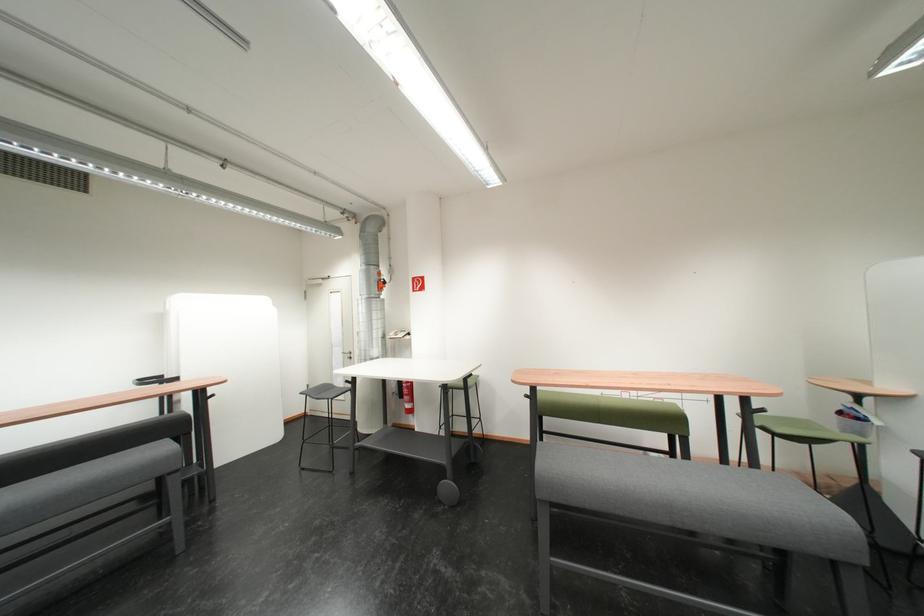
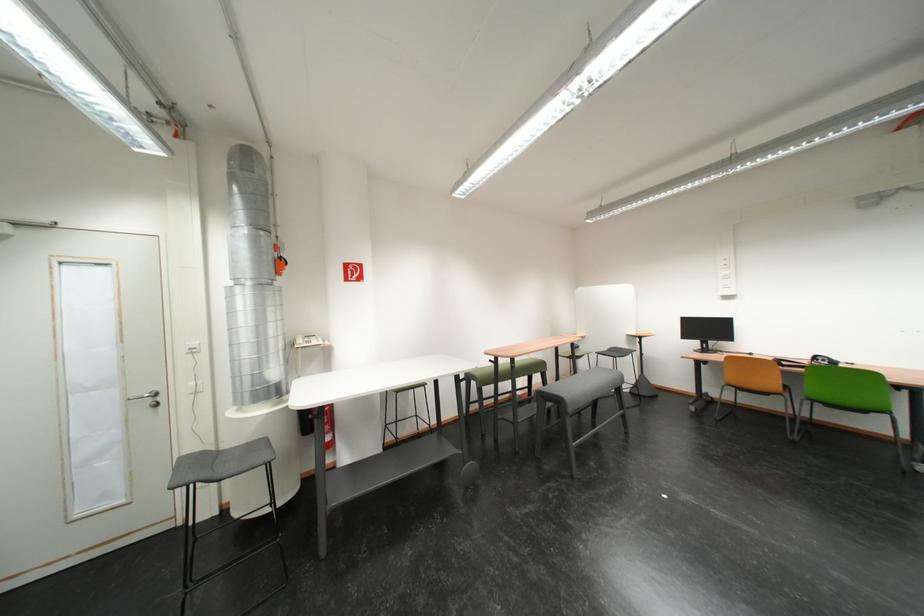
Find the pixel in the second image that matches (387,286) in the first image.

(284, 265)